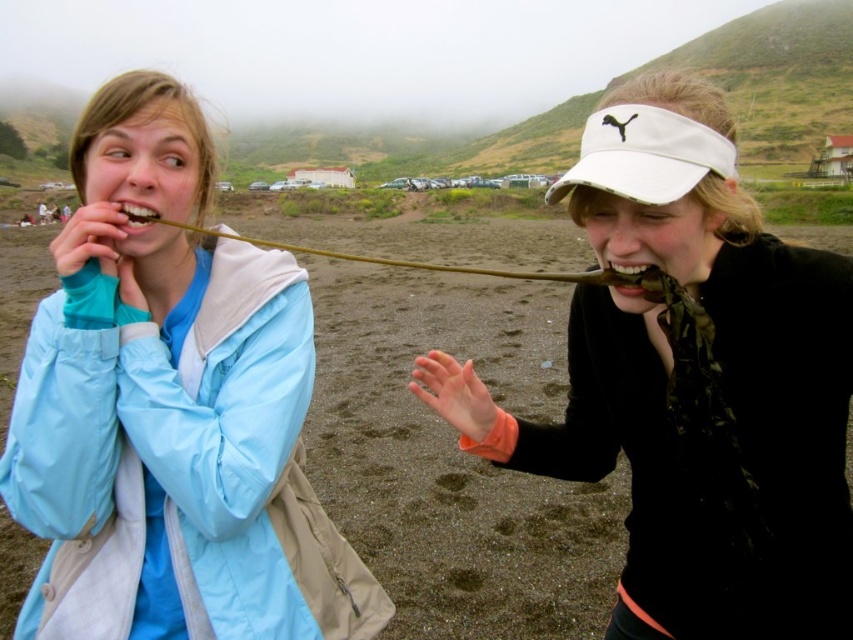
Is point (122, 609) positioned after point (722, 566)?

That is True.

Is matte blue jacket at left smaller than white matte visor at center?

Yes, matte blue jacket at left is smaller than white matte visor at center.

Who is more forward, (57, 573) or (605, 438)?

Positioned in front is point (57, 573).

Locate an element on the screen. The height and width of the screenshot is (640, 853). matte blue jacket at left is located at coordinates (170, 410).